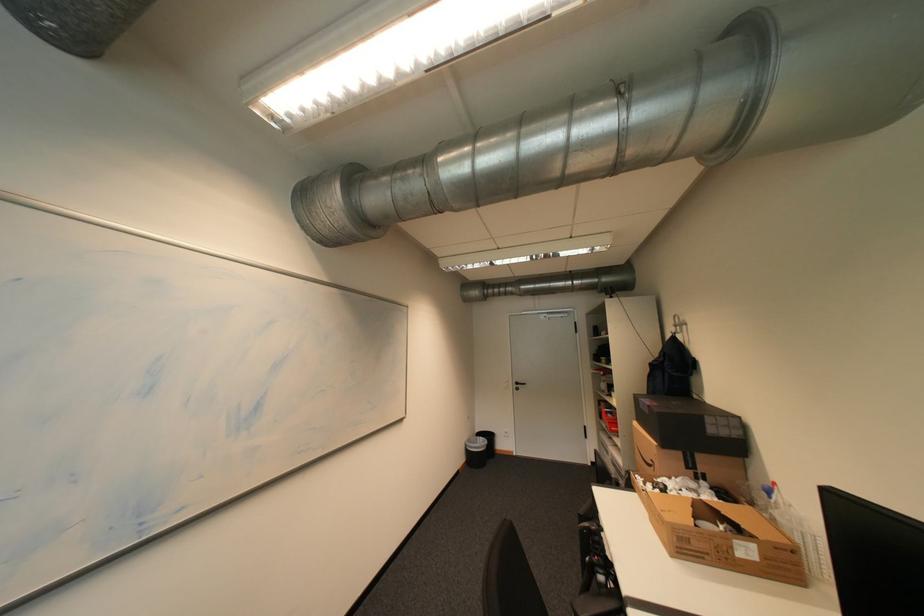
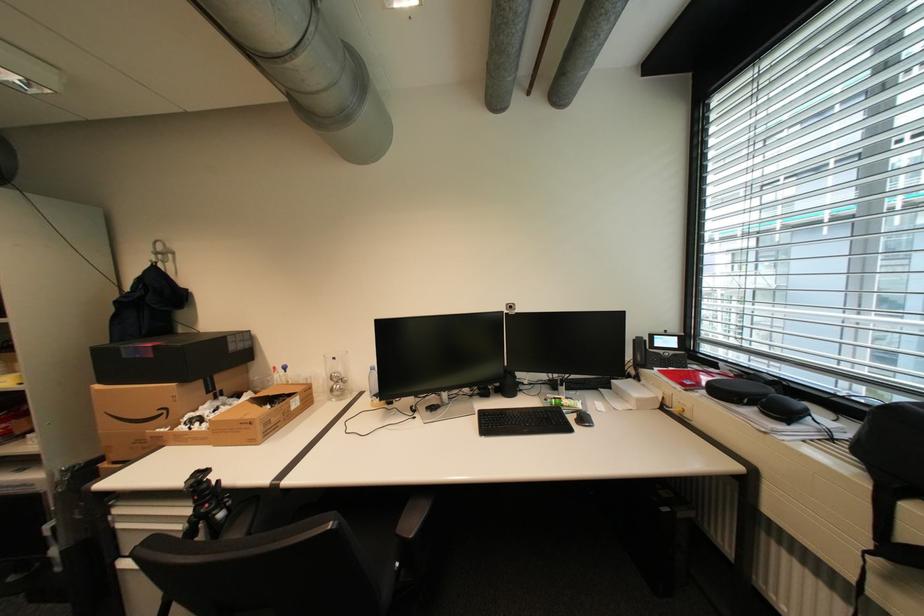
Where in the second image is the point corresponding to point 662,464 from the first image?

(174, 411)